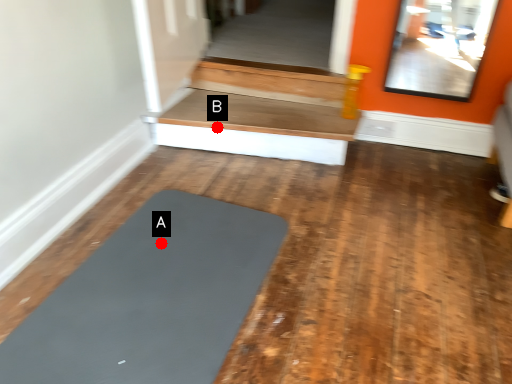
Question: Two points are circled on the image, labeled by A and B beside each circle. Among these points, which one is nearest to the camera?

Choices:
 (A) A is closer
 (B) B is closer

Answer: (A)